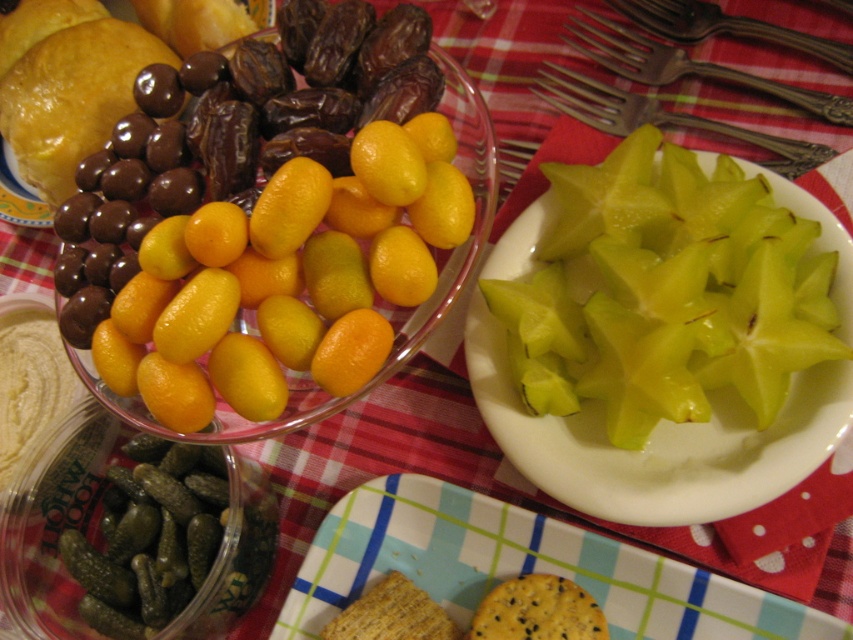
Between polished metal fork at upper right and seeded yellow biscuit at center, which one has more height?

polished metal fork at upper right is taller.

Who is shorter, polished metal fork at upper right or seeded yellow biscuit at center?

seeded yellow biscuit at center

Find the location of `polished metal fork at upper right`. polished metal fork at upper right is located at coordinates (683, 65).

How far apart are green shiny starfruit at right and polished metal forks at upper right?

They are 6.73 inches apart.

Is point (648, 403) in front of point (799, 152)?

Yes.

Locate an element on the screen. Image resolution: width=853 pixels, height=640 pixels. green shiny starfruit at right is located at coordinates (659, 292).

Is polished metal forks at upper right thinner than polished metal fork at upper right?

No.

Can you confirm if polished metal forks at upper right is positioned to the right of polished metal fork at upper right?

In fact, polished metal forks at upper right is to the left of polished metal fork at upper right.

From the picture: Measure the distance between polished metal forks at upper right and camera.

The distance of polished metal forks at upper right from camera is 23.58 inches.

At what (x,y) coordinates should I click in order to perform the action: click on polished metal forks at upper right. Please return your answer as a coordinate pair (x, y). The image size is (853, 640). Looking at the image, I should click on (660, 116).